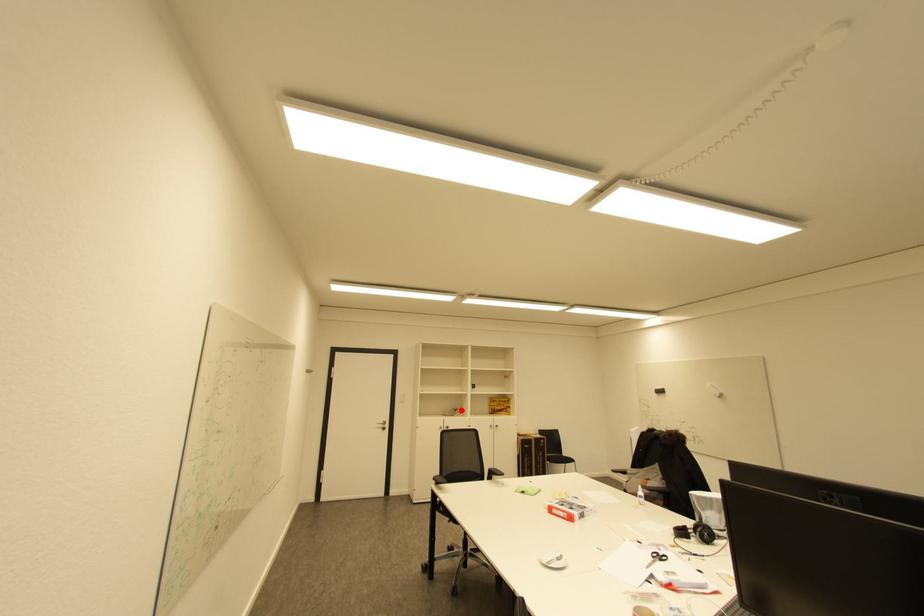
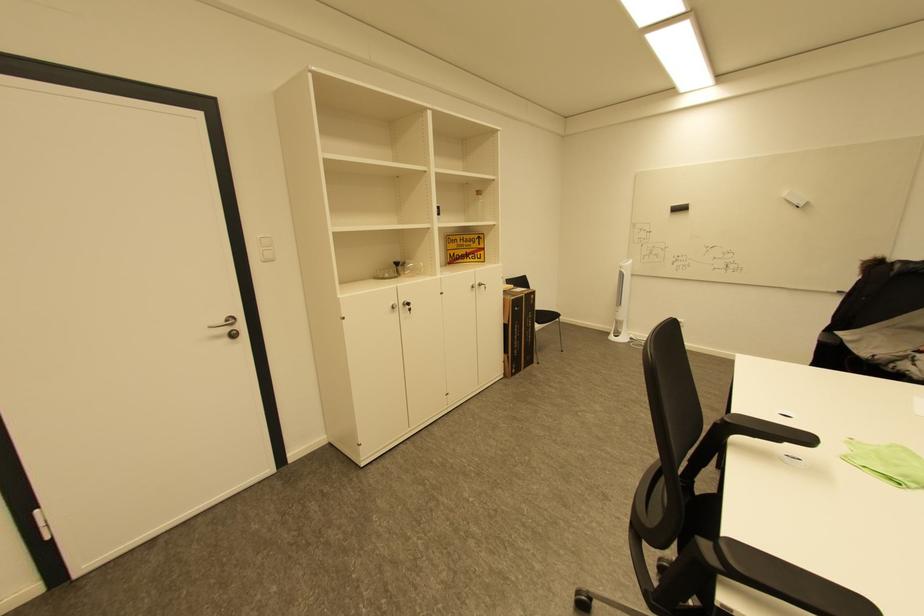
Locate, in the second image, the point that corresponds to the highlighted location in the first image.

(403, 264)